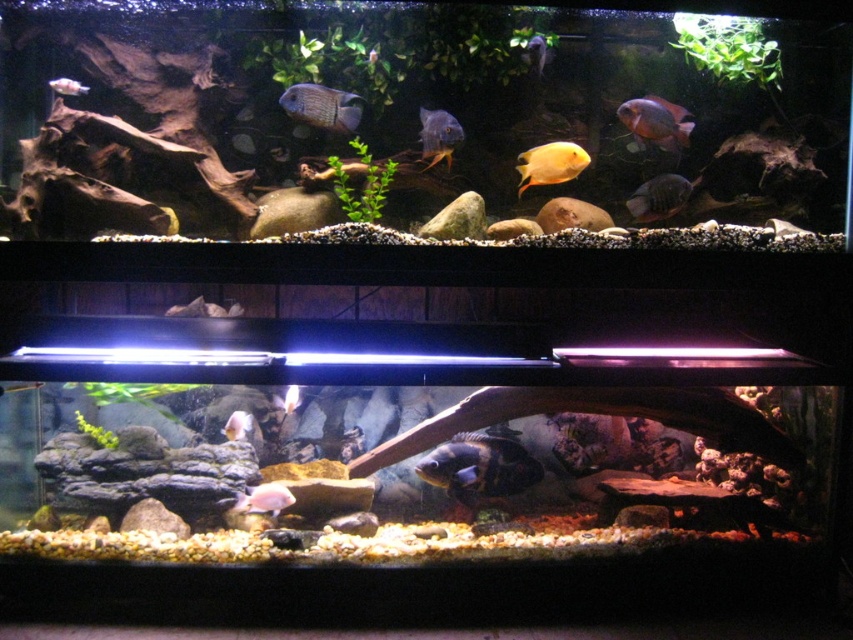
Question: Does shiny blue fish at center appear over white matte fish at lower center?

Choices:
 (A) yes
 (B) no

Answer: (B)

Question: Which of these objects is positioned closest to the matte blue fish at center?

Choices:
 (A) shiny blue fish at center
 (B) pink matte fish at lower center
 (C) matte black fish at center

Answer: (C)

Question: Can you confirm if matte blue fish at center is positioned below pink matte fish at center?

Choices:
 (A) no
 (B) yes

Answer: (A)

Question: Which of the following is the closest to the observer?

Choices:
 (A) (434, 156)
 (B) (287, 490)
 (C) (489, 465)
 (D) (283, 397)

Answer: (B)

Question: Which object is positioned closest to the shiny blue fish at upper center?

Choices:
 (A) matte orange fish at upper center
 (B) white matte fish at lower center

Answer: (A)

Question: In this image, where is pink matte fish at lower center located relative to white matte fish at lower center?

Choices:
 (A) right
 (B) left

Answer: (B)